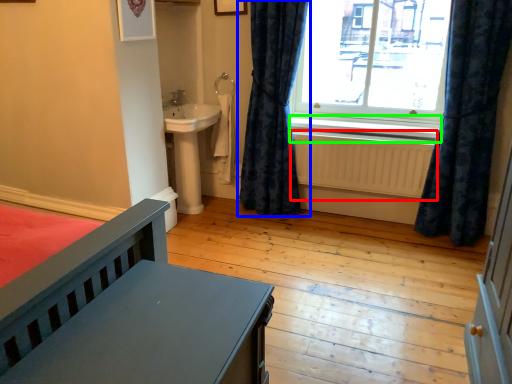
Question: Based on their relative distances, which object is nearer to radiator (highlighted by a red box)? Choose from curtain (highlighted by a blue box) and window sill (highlighted by a green box).

Choices:
 (A) curtain
 (B) window sill

Answer: (B)